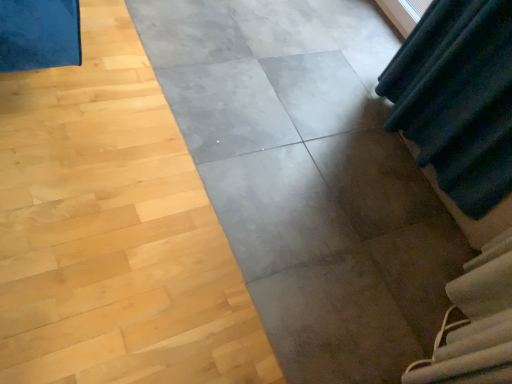
Question: Is gray concrete at center inside or outside of white fabric at lower right?

Choices:
 (A) inside
 (B) outside

Answer: (B)

Question: From a real-world perspective, is gray concrete at center physically located above or below white fabric at lower right?

Choices:
 (A) below
 (B) above

Answer: (A)

Question: Looking at the image, does gray concrete at center seem bigger or smaller compared to white fabric at lower right?

Choices:
 (A) big
 (B) small

Answer: (A)

Question: In terms of width, does white fabric at lower right look wider or thinner when compared to gray concrete at center?

Choices:
 (A) thin
 (B) wide

Answer: (A)

Question: In terms of height, does white fabric at lower right look taller or shorter compared to gray concrete at center?

Choices:
 (A) short
 (B) tall

Answer: (B)

Question: Is white fabric at lower right bigger or smaller than gray concrete at center?

Choices:
 (A) small
 (B) big

Answer: (A)

Question: Do you think white fabric at lower right is within gray concrete at center, or outside of it?

Choices:
 (A) outside
 (B) inside

Answer: (A)